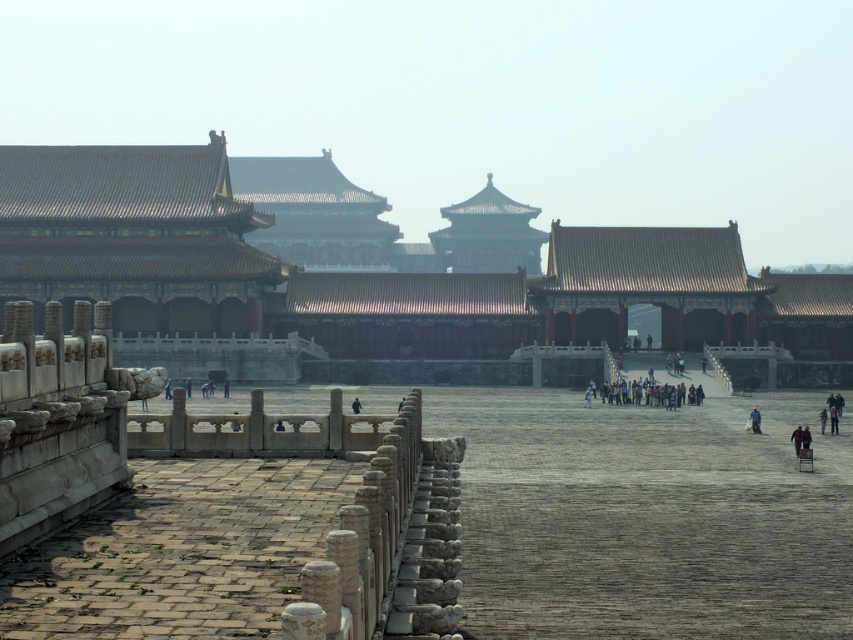
Which of these two, shiny gold roof at center or dark brown leather jacket at lower right, stands shorter?

dark brown leather jacket at lower right is shorter.

Looking at this image, who is more forward, (157, 212) or (793, 444)?

Point (793, 444) is more forward.

Locate an element on the screen. This screenshot has width=853, height=640. shiny gold roof at center is located at coordinates (378, 275).

Who is more distant from viewer, (665, 403) or (753, 413)?

Positioned behind is point (665, 403).

Where is `dark gray stone people at center`? This screenshot has width=853, height=640. dark gray stone people at center is located at coordinates (656, 394).

Does point (332, 337) lie behind point (755, 416)?

Yes.

Does shiny gold roof at center lie behind yellow fabric person at center?

No, it is not.

Image resolution: width=853 pixels, height=640 pixels. What do you see at coordinates (378, 275) in the screenshot?
I see `shiny gold roof at center` at bounding box center [378, 275].

Find the location of `shiny gold roof at center`. shiny gold roof at center is located at coordinates (378, 275).